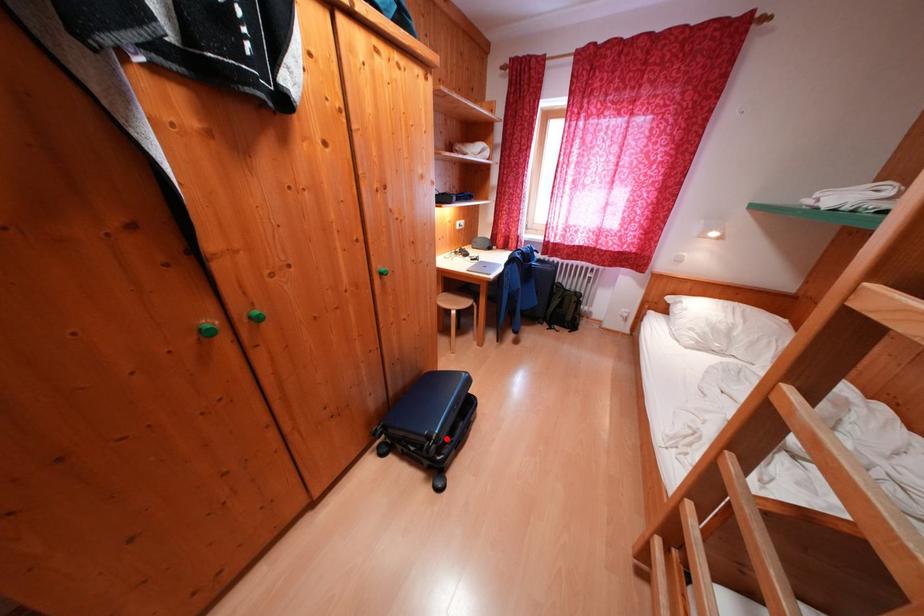
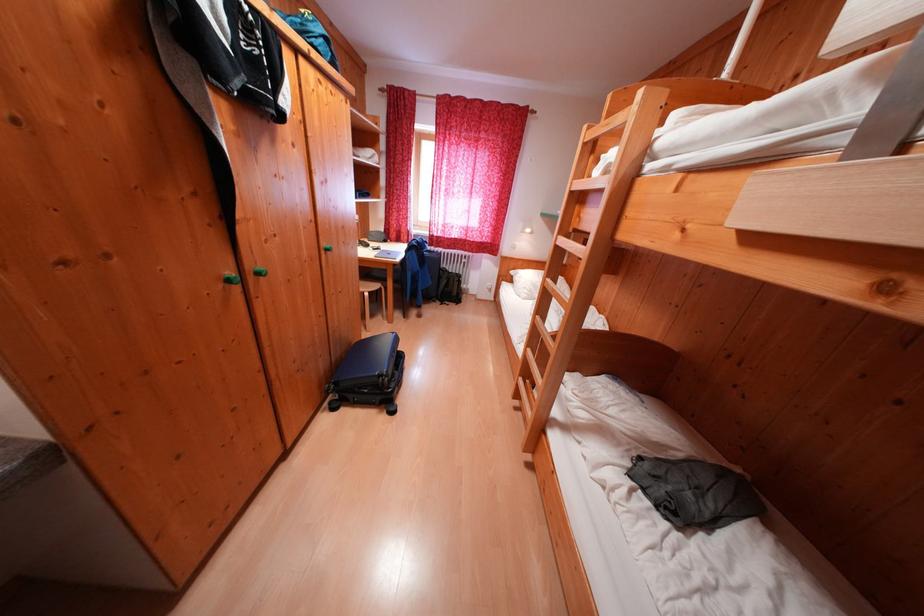
Question: I am providing you with two images of the same scene from different viewpoints. Given a red point in image1, look at the same physical point in image2. Is it:

Choices:
 (A) Closer to the viewpoint
 (B) Farther from the viewpoint

Answer: (A)